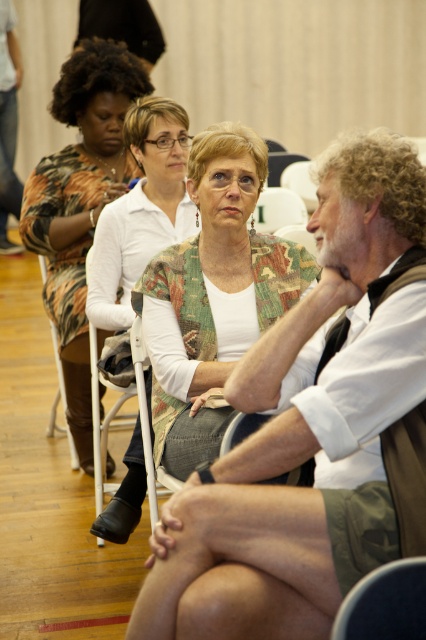
Question: Which point is farther to the camera?

Choices:
 (A) (167, 138)
 (B) (63, 108)
 (C) (334, 528)

Answer: (B)

Question: Observing the image, what is the correct spatial positioning of camouflage-patterned jacket at center in reference to white textured shirt at center?

Choices:
 (A) below
 (B) above

Answer: (A)

Question: Is white shirt at center positioned behind printed fabric dress at center?

Choices:
 (A) yes
 (B) no

Answer: (B)

Question: Estimate the real-world distances between objects in this image. Which object is farther from the white shirt at center?

Choices:
 (A) camouflage-patterned jacket at center
 (B) printed fabric dress at center

Answer: (B)

Question: Which of the following is the farthest from the observer?

Choices:
 (A) printed fabric dress at center
 (B) white shirt at center
 (C) camouflage-patterned jacket at center

Answer: (A)

Question: Does white shirt at center come in front of camouflage-patterned jacket at center?

Choices:
 (A) no
 (B) yes

Answer: (B)